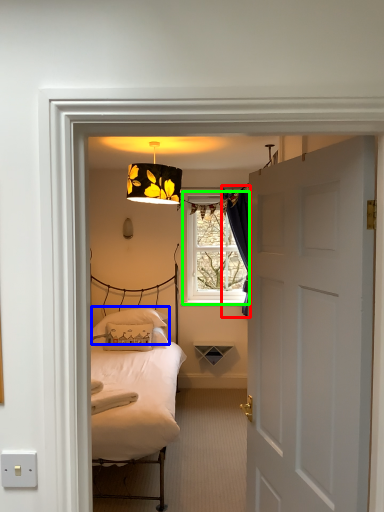
Question: Which object is positioned farthest from curtain (highlighted by a red box)? Select from pillow (highlighted by a blue box) and window (highlighted by a green box).

Choices:
 (A) pillow
 (B) window

Answer: (A)